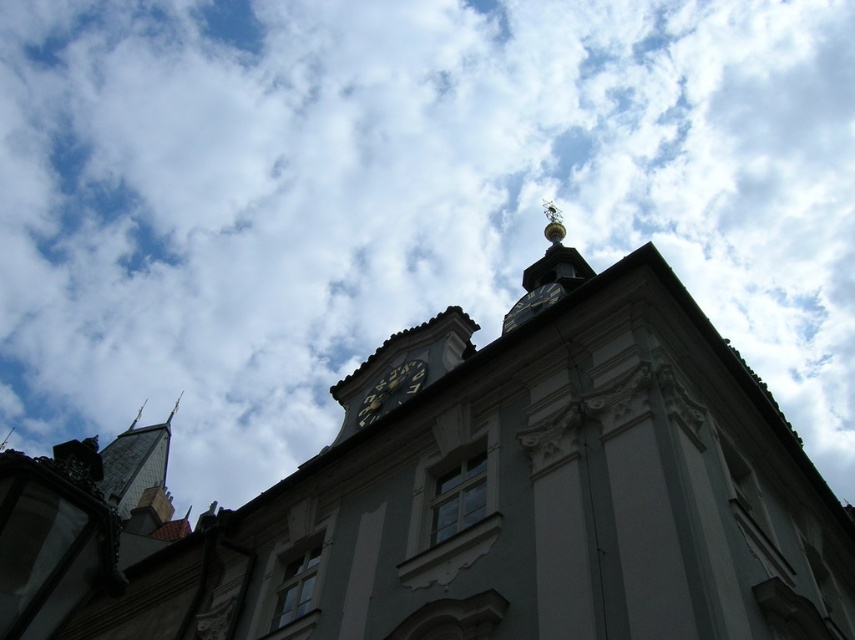
Question: Based on their relative distances, which object is nearer to the gray stone tower at left?

Choices:
 (A) black metal clock at center
 (B) gold metallic clock at upper center

Answer: (A)

Question: Does gray stone tower at left appear on the right side of black metal clock at center?

Choices:
 (A) yes
 (B) no

Answer: (B)

Question: Is gray stone tower at left behind gold metallic clock at upper center?

Choices:
 (A) yes
 (B) no

Answer: (B)

Question: Which point appears closest to the camera in this image?

Choices:
 (A) [x=538, y=310]
 (B) [x=369, y=388]

Answer: (B)

Question: Where is black metal clock at center located in relation to gold metallic clock at upper center in the image?

Choices:
 (A) right
 (B) left

Answer: (B)

Question: Among these points, which one is farthest from the camera?

Choices:
 (A) (128, 426)
 (B) (388, 394)

Answer: (A)